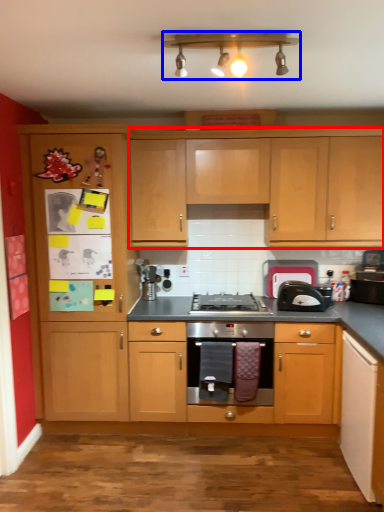
Question: Which object is closer to the camera taking this photo, cabinetry (highlighted by a red box) or light fixture (highlighted by a blue box)?

Choices:
 (A) cabinetry
 (B) light fixture

Answer: (B)